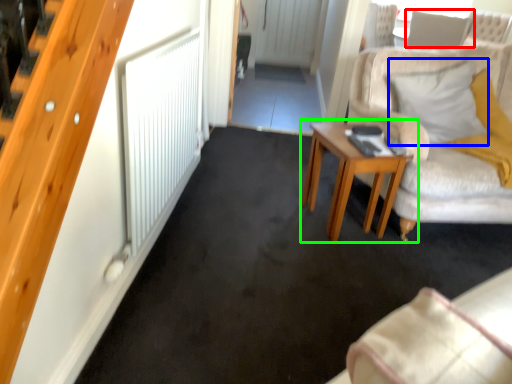
Question: Which object is the closest to the pillow (highlighted by a red box)? Choose among these: pillow (highlighted by a blue box) or table (highlighted by a green box).

Choices:
 (A) pillow
 (B) table

Answer: (A)